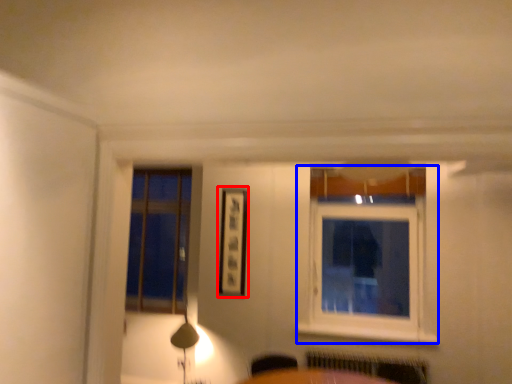
Question: Among these objects, which one is nearest to the camera, picture frame (highlighted by a red box) or window (highlighted by a blue box)?

Choices:
 (A) picture frame
 (B) window

Answer: (B)